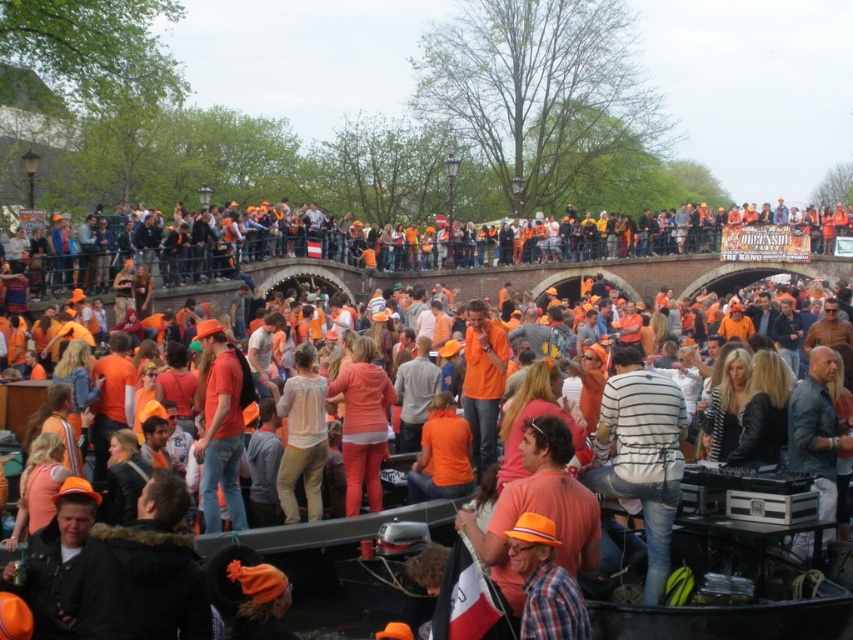
Question: Observing the image, what is the correct spatial positioning of matte orange shirt at center in reference to plaid fabric hat at center?

Choices:
 (A) left
 (B) right

Answer: (A)

Question: Is matte orange shirt at center closer to camera compared to plaid fabric hat at center?

Choices:
 (A) no
 (B) yes

Answer: (A)

Question: Observing the image, what is the correct spatial positioning of matte orange shirt at center in reference to plaid fabric hat at center?

Choices:
 (A) left
 (B) right

Answer: (A)

Question: Which point is farther from the camera taking this photo?

Choices:
 (A) (529, 545)
 (B) (358, 344)

Answer: (B)

Question: Which of the following is the farthest from the observer?

Choices:
 (A) (555, 612)
 (B) (347, 381)

Answer: (B)

Question: Which of the following is the farthest from the observer?

Choices:
 (A) plaid fabric hat at center
 (B) matte orange shirt at center

Answer: (B)